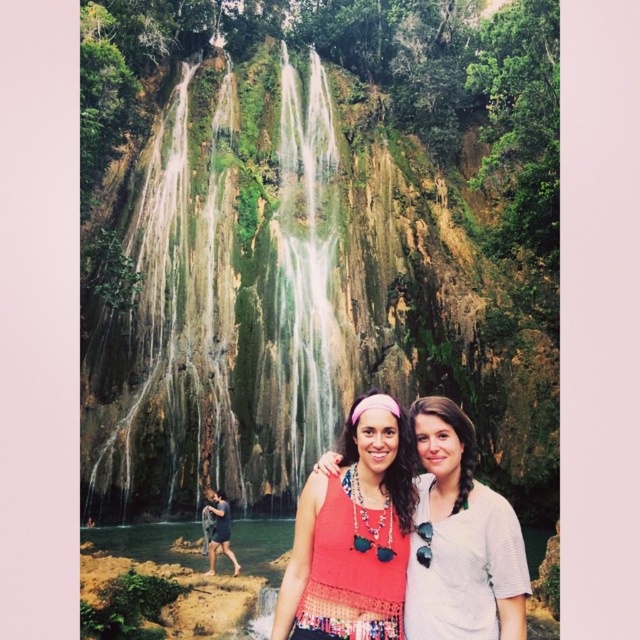
Is white textured shirt at center above dark blue shorts at lower left?

Indeed, white textured shirt at center is positioned over dark blue shorts at lower left.

Describe the element at coordinates (460, 540) in the screenshot. I see `white textured shirt at center` at that location.

Is point (424, 612) in front of point (227, 531)?

Yes.

Where is `white textured shirt at center`? The height and width of the screenshot is (640, 640). white textured shirt at center is located at coordinates (460, 540).

Does crochet tank top at center have a larger size compared to dark blue shorts at lower left?

Correct, crochet tank top at center is larger in size than dark blue shorts at lower left.

Does point (358, 570) come in front of point (211, 531)?

Yes, it is in front of point (211, 531).

Which is behind, point (346, 620) or point (236, 561)?

The point (236, 561) is behind.

In order to click on crochet tank top at center in this screenshot , I will do `click(353, 536)`.

Is point (294, 369) behind point (385, 602)?

Yes.

Which is below, green mossy waterfall at center or crochet tank top at center?

crochet tank top at center

Between point (328, 243) and point (396, 508), which one is positioned behind?

The point (328, 243) is more distant.

The image size is (640, 640). Identify the location of green mossy waterfall at center. [x=220, y=316].